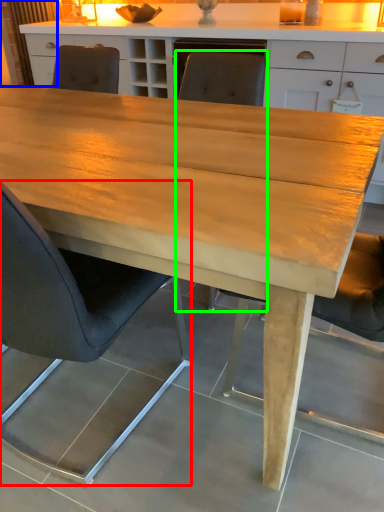
Question: Which object is positioned farthest from chair (highlighted by a red box)? Select from curtain (highlighted by a blue box) and chair (highlighted by a green box).

Choices:
 (A) curtain
 (B) chair

Answer: (A)